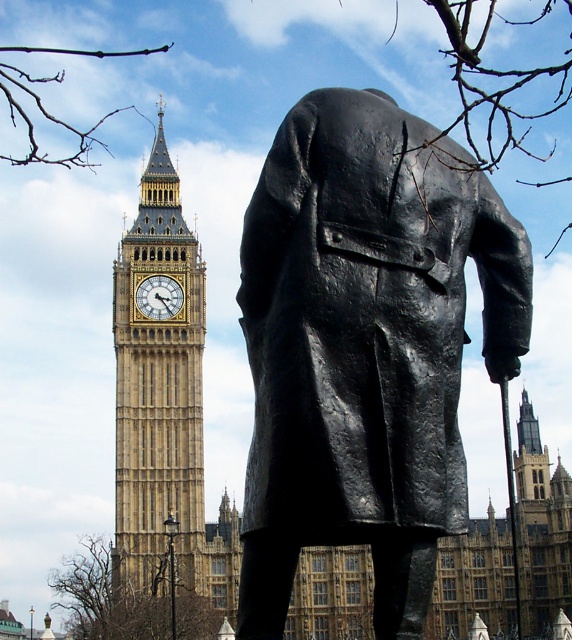
Does black polished statue at center appear on the left side of gold-gilded clock at center?

In fact, black polished statue at center is to the right of gold-gilded clock at center.

Is point (366, 508) closer to viewer compared to point (168, 300)?

That is True.

Locate an element on the screen. black polished statue at center is located at coordinates (364, 348).

Does golden stone clock tower at left have a greater height compared to gold-gilded clock at center?

Indeed, golden stone clock tower at left has a greater height compared to gold-gilded clock at center.

Who is shorter, golden stone clock tower at left or gold-gilded clock at center?

gold-gilded clock at center

Which is in front, point (141, 227) or point (143, 284)?

Point (143, 284) is more forward.

This screenshot has height=640, width=572. What are the coordinates of `golden stone clock tower at left` in the screenshot? It's located at 158,394.

Between point (459, 182) and point (133, 305), which one is positioned behind?

Positioned behind is point (133, 305).

At what (x,y) coordinates should I click in order to perform the action: click on black polished statue at center. Please return your answer as a coordinate pair (x, y). Looking at the image, I should click on (364, 348).

Where is `black polished statue at center`? black polished statue at center is located at coordinates (364, 348).